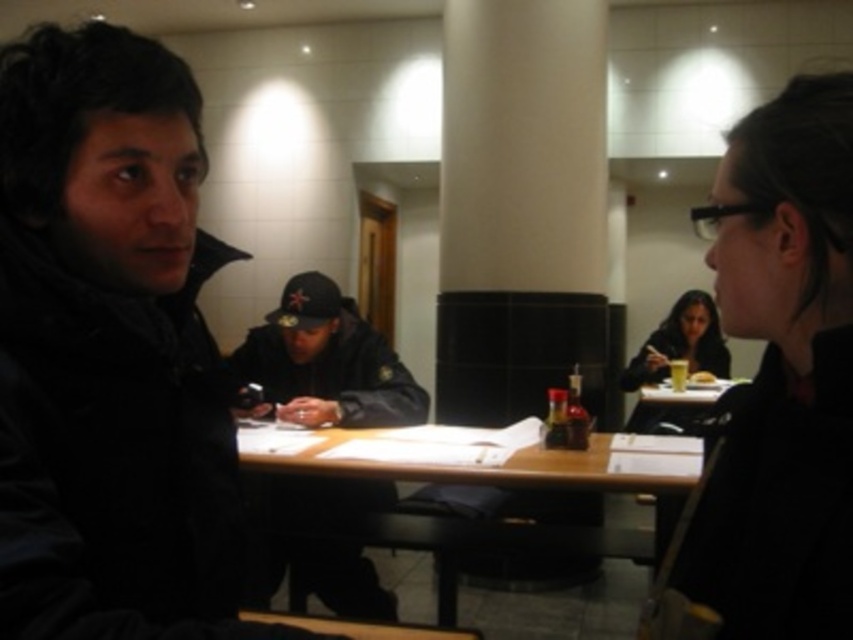
Which of these two, black matte jacket at upper right or matte black jacket at lower right, stands taller?

matte black jacket at lower right is taller.

Who is more forward, (747, 451) or (706, 324)?

Point (747, 451)

Does point (798, 248) come closer to viewer compared to point (662, 428)?

Yes.

Find the location of a particular element. The image size is (853, 640). black matte jacket at upper right is located at coordinates (776, 385).

Who is positioned more to the right, black matte jacket at upper right or black matte jacket at center?

Positioned to the right is black matte jacket at upper right.

Does black matte jacket at upper right have a lesser width compared to black matte jacket at center?

Correct, black matte jacket at upper right's width is less than black matte jacket at center's.

Does point (782, 253) come behind point (277, 582)?

No.

This screenshot has height=640, width=853. Find the location of `black matte jacket at upper right`. black matte jacket at upper right is located at coordinates (x=776, y=385).

Is black matte jacket at center positioned behind wooden table at center?

No.

How far apart are black matte jacket at center and wooden table at center?

black matte jacket at center and wooden table at center are 15.95 inches apart from each other.

Who is more forward, (285, 378) or (570, 540)?

Positioned in front is point (570, 540).

At what (x,y) coordinates should I click in order to perform the action: click on black matte jacket at center. Please return your answer as a coordinate pair (x, y). Looking at the image, I should click on (323, 364).